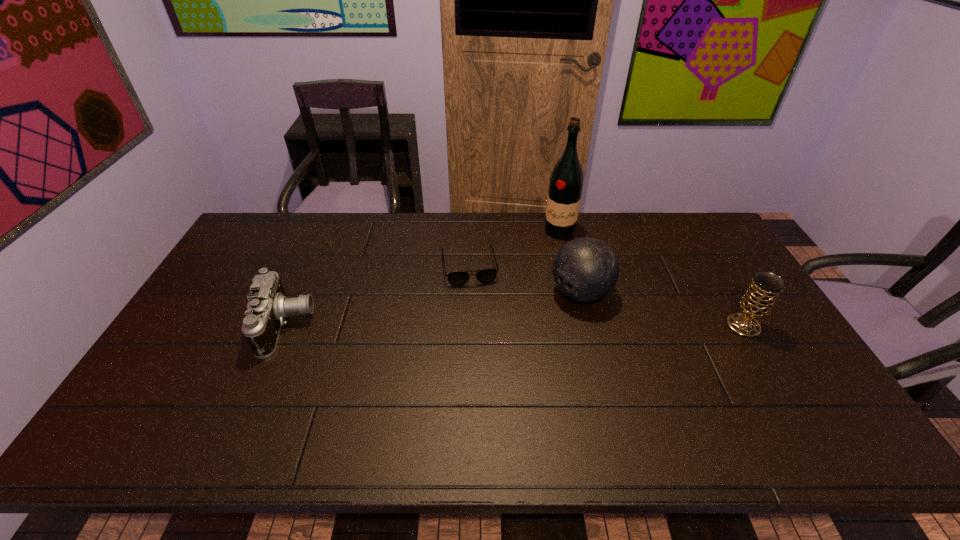
Find the location of `vacant space on the desktop that is between the fourth tallest object and the rightmost object and is positioned on the grip area of the bowling ball`. vacant space on the desktop that is between the fourth tallest object and the rightmost object and is positioned on the grip area of the bowling ball is located at coordinates (534, 326).

Identify the location of vacant space on the desktop that is between the fourth tallest object and the chalice and is positioned on the front-facing side of the shortest object. (481, 326).

The height and width of the screenshot is (540, 960). Identify the location of vacant space on the desktop that is between the second shortest object and the rightmost object and is positioned on the front-facing side of the liquor. (533, 326).